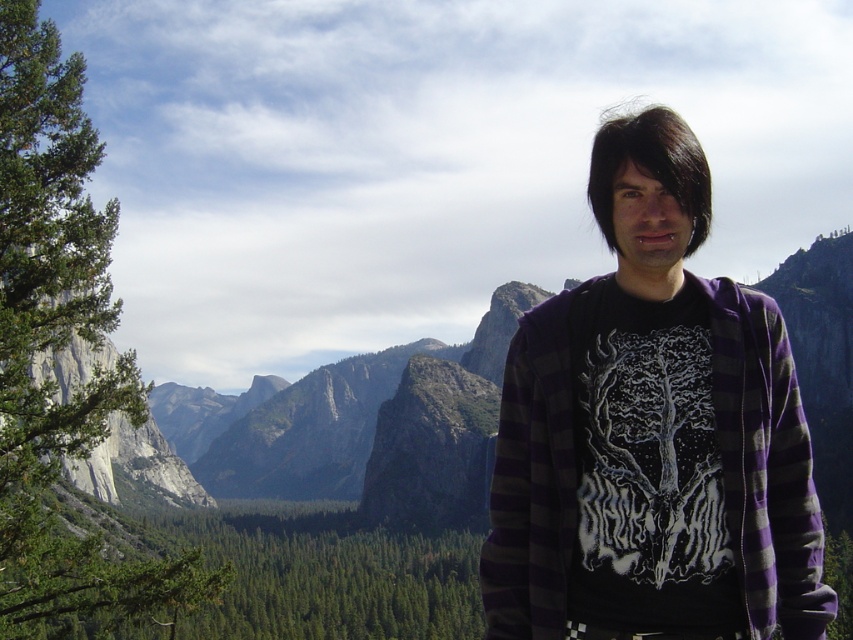
Question: Which of the following is the farthest from the observer?

Choices:
 (A) purple flannel shirt at center
 (B) green leafy tree at left

Answer: (B)

Question: Does purple flannel shirt at center have a greater width compared to green leafy tree at left?

Choices:
 (A) no
 (B) yes

Answer: (A)

Question: Is purple flannel shirt at center wider than green leafy tree at left?

Choices:
 (A) yes
 (B) no

Answer: (B)

Question: Is purple flannel shirt at center above green leafy tree at left?

Choices:
 (A) no
 (B) yes

Answer: (B)